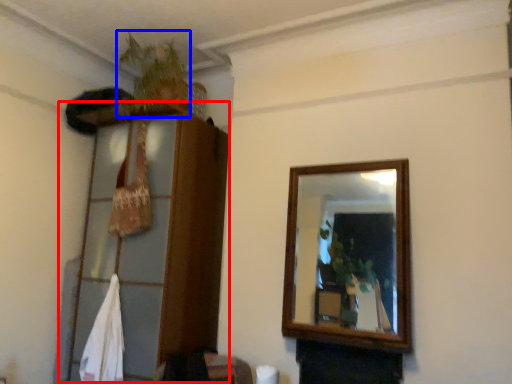
Question: Which object appears closest to the camera in this image, dresser (highlighted by a red box) or plant (highlighted by a blue box)?

Choices:
 (A) dresser
 (B) plant

Answer: (A)